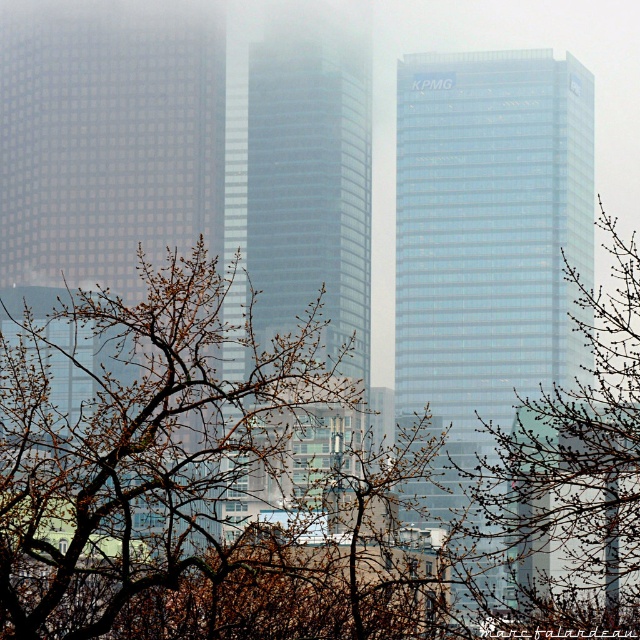
Question: Which point is farther to the camera?

Choices:
 (A) bare branches at center
 (B) matte glass skyscraper at left
 (C) transparent glass skyscraper at center
 (D) glassy blue skyscraper at center

Answer: (D)

Question: Is matte glass skyscraper at left to the right of glassy blue skyscraper at center from the viewer's perspective?

Choices:
 (A) yes
 (B) no

Answer: (B)

Question: Which point is farther to the camera?

Choices:
 (A) (109, 342)
 (B) (444, 209)
 (C) (266, 221)

Answer: (B)

Question: Considering the relative positions of bare branches at center and matte glass skyscraper at left in the image provided, where is bare branches at center located with respect to matte glass skyscraper at left?

Choices:
 (A) right
 (B) left

Answer: (A)

Question: Is bare branches at center positioned before transparent glass skyscraper at center?

Choices:
 (A) yes
 (B) no

Answer: (A)

Question: Among these points, which one is nearest to the camera?

Choices:
 (A) (276, 497)
 (B) (397, 385)

Answer: (A)